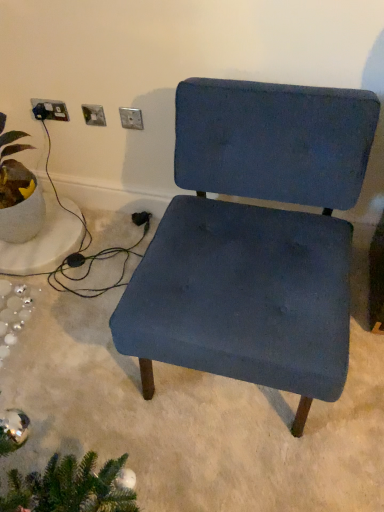
Where is `satin silver socket at upper center, which appears as the second electric outlet when viewed from the right`? Image resolution: width=384 pixels, height=512 pixels. satin silver socket at upper center, which appears as the second electric outlet when viewed from the right is located at coordinates (94, 115).

Measure the distance between point [133,113] and camera.

Point [133,113] and camera are 1.56 meters apart from each other.

Describe the element at coordinates (18, 191) in the screenshot. The width and height of the screenshot is (384, 512). I see `matte ceramic plant at left` at that location.

What is the approximate height of matte ceramic plant at left?

The height of matte ceramic plant at left is 49.73 centimeters.

Identify the location of satin silver socket at upper center, acting as the second electric outlet starting from the left. (94, 115).

At what (x,y) coordinates should I click in order to perform the action: click on electric outlet below the satin silver socket at upper center, which appears as the second electric outlet when viewed from the right (from the image's perspective). Please return your answer as a coordinate pair (x, y). The width and height of the screenshot is (384, 512). Looking at the image, I should click on (131, 118).

Considering the relative sizes of metallic silver outlet at upper center, the third electric outlet when ordered from left to right, and satin silver socket at upper center, which appears as the second electric outlet when viewed from the right, in the image provided, is metallic silver outlet at upper center, the third electric outlet when ordered from left to right, wider than satin silver socket at upper center, which appears as the second electric outlet when viewed from the right,?

Indeed, metallic silver outlet at upper center, the third electric outlet when ordered from left to right, has a greater width compared to satin silver socket at upper center, which appears as the second electric outlet when viewed from the right.

Considering the relative positions of metallic silver outlet at upper center, the 1th electric outlet from the right, and satin silver socket at upper center, acting as the second electric outlet starting from the left, in the image provided, is metallic silver outlet at upper center, the 1th electric outlet from the right, to the right of satin silver socket at upper center, acting as the second electric outlet starting from the left, from the viewer's perspective?

Yes.

Which is behind, point (142, 118) or point (88, 114)?

Positioned behind is point (88, 114).

Is satin silver socket at upper center, which appears as the second electric outlet when viewed from the right, next to metallic silver outlet at upper center, the 1th electric outlet from the right, and touching it?

No, satin silver socket at upper center, which appears as the second electric outlet when viewed from the right, is not with metallic silver outlet at upper center, the 1th electric outlet from the right.

Is the position of satin silver socket at upper center, acting as the second electric outlet starting from the left, more distant than that of metallic silver outlet at upper center, the 1th electric outlet from the right?

Yes, satin silver socket at upper center, acting as the second electric outlet starting from the left, is behind metallic silver outlet at upper center, the 1th electric outlet from the right.

Can you tell me how much satin silver socket at upper center, which appears as the second electric outlet when viewed from the right, and metallic silver outlet at upper center, the 1th electric outlet from the right, differ in facing direction?

satin silver socket at upper center, which appears as the second electric outlet when viewed from the right, and metallic silver outlet at upper center, the 1th electric outlet from the right, are facing 1.42 degrees away from each other.

Is point (104, 125) closer to camera compared to point (131, 113)?

No, (104, 125) is further to viewer.

Which is closer to the camera, (125, 320) or (101, 119)?

The point (125, 320) is in front.

Considering the relative sizes of velvet blue chair at center and satin silver socket at upper center, which appears as the second electric outlet when viewed from the right, in the image provided, is velvet blue chair at center thinner than satin silver socket at upper center, which appears as the second electric outlet when viewed from the right,?

No, velvet blue chair at center is not thinner than satin silver socket at upper center, which appears as the second electric outlet when viewed from the right.

Considering the relative positions of velvet blue chair at center and satin silver socket at upper center, acting as the second electric outlet starting from the left, in the image provided, is velvet blue chair at center to the right of satin silver socket at upper center, acting as the second electric outlet starting from the left, from the viewer's perspective?

Yes, velvet blue chair at center is to the right of satin silver socket at upper center, acting as the second electric outlet starting from the left.

Considering the sizes of matte ceramic plant at left and velvet blue chair at center in the image, is matte ceramic plant at left wider or thinner than velvet blue chair at center?

In the image, matte ceramic plant at left appears to be more narrow than velvet blue chair at center.

Can you confirm if matte ceramic plant at left is bigger than velvet blue chair at center?

Incorrect, matte ceramic plant at left is not larger than velvet blue chair at center.

Considering the positions of objects matte ceramic plant at left and velvet blue chair at center in the image provided, who is more to the left, matte ceramic plant at left or velvet blue chair at center?

matte ceramic plant at left is more to the left.

Is matte ceramic plant at left completely or partially outside of velvet blue chair at center?

Indeed, matte ceramic plant at left is completely outside velvet blue chair at center.

From a real-world perspective, which is physically below, matte ceramic plant at left or satin silver socket at upper left, the 1th electric outlet when ordered from left to right?

From a 3D spatial view, matte ceramic plant at left is below.

Relative to satin silver socket at upper left, the 1th electric outlet when ordered from left to right, is matte ceramic plant at left in front or behind?

matte ceramic plant at left is in front of satin silver socket at upper left, the 1th electric outlet when ordered from left to right.

Based on the photo, considering the sizes of objects matte ceramic plant at left and satin silver socket at upper left, positioned as the third electric outlet in right-to-left order, in the image provided, who is shorter, matte ceramic plant at left or satin silver socket at upper left, positioned as the third electric outlet in right-to-left order,?

With less height is satin silver socket at upper left, positioned as the third electric outlet in right-to-left order.

From the picture: Is there a large distance between satin silver socket at upper center, acting as the second electric outlet starting from the left, and velvet blue chair at center?

No, there isn't a large distance between satin silver socket at upper center, acting as the second electric outlet starting from the left, and velvet blue chair at center.

Image resolution: width=384 pixels, height=512 pixels. Identify the location of the 2nd electric outlet behind when counting from the velvet blue chair at center. (94, 115).

From a real-world perspective, between satin silver socket at upper center, acting as the second electric outlet starting from the left, and velvet blue chair at center, who is vertically lower?

velvet blue chair at center is physically lower.

Can you tell me how much satin silver socket at upper center, which appears as the second electric outlet when viewed from the right, and velvet blue chair at center differ in facing direction?

satin silver socket at upper center, which appears as the second electric outlet when viewed from the right, and velvet blue chair at center are facing 4.52 degrees away from each other.

Can you confirm if satin silver socket at upper center, which appears as the second electric outlet when viewed from the right, is bigger than satin silver socket at upper left, positioned as the third electric outlet in right-to-left order?

Actually, satin silver socket at upper center, which appears as the second electric outlet when viewed from the right, might be smaller than satin silver socket at upper left, positioned as the third electric outlet in right-to-left order.

Are satin silver socket at upper center, acting as the second electric outlet starting from the left, and satin silver socket at upper left, the 1th electric outlet when ordered from left to right, making contact?

No, satin silver socket at upper center, acting as the second electric outlet starting from the left, is not making contact with satin silver socket at upper left, the 1th electric outlet when ordered from left to right.

From the image's perspective, who appears lower, satin silver socket at upper center, acting as the second electric outlet starting from the left, or satin silver socket at upper left, the 1th electric outlet when ordered from left to right?

satin silver socket at upper center, acting as the second electric outlet starting from the left, appears lower in the image.

From a real-world perspective, starting from the satin silver socket at upper center, which appears as the second electric outlet when viewed from the right, which electric outlet is the 1st one vertically above it? Please provide its 2D coordinates.

[(131, 118)]

I want to click on the 1st electric outlet behind when counting from the metallic silver outlet at upper center, the third electric outlet when ordered from left to right, so click(94, 115).

When comparing their distances from velvet blue chair at center, does satin silver socket at upper left, positioned as the third electric outlet in right-to-left order, or metallic silver outlet at upper center, the third electric outlet when ordered from left to right, seem further?

satin silver socket at upper left, positioned as the third electric outlet in right-to-left order.

Which object lies nearer to the anchor point velvet blue chair at center, satin silver socket at upper center, which appears as the second electric outlet when viewed from the right, or matte ceramic plant at left?

Among the two, satin silver socket at upper center, which appears as the second electric outlet when viewed from the right, is located nearer to velvet blue chair at center.

Which object lies further to the anchor point matte ceramic plant at left, velvet blue chair at center or satin silver socket at upper center, which appears as the second electric outlet when viewed from the right?

Based on the image, velvet blue chair at center appears to be further to matte ceramic plant at left.

Based on their spatial positions, is metallic silver outlet at upper center, the 1th electric outlet from the right, or matte ceramic plant at left closer to satin silver socket at upper left, positioned as the third electric outlet in right-to-left order?

metallic silver outlet at upper center, the 1th electric outlet from the right, is closer to satin silver socket at upper left, positioned as the third electric outlet in right-to-left order.

Estimate the real-world distances between objects in this image. Which object is closer to metallic silver outlet at upper center, the third electric outlet when ordered from left to right, satin silver socket at upper left, positioned as the third electric outlet in right-to-left order, or matte ceramic plant at left?

The object closer to metallic silver outlet at upper center, the third electric outlet when ordered from left to right, is satin silver socket at upper left, positioned as the third electric outlet in right-to-left order.

Based on their spatial positions, is satin silver socket at upper center, which appears as the second electric outlet when viewed from the right, or velvet blue chair at center closer to satin silver socket at upper left, positioned as the third electric outlet in right-to-left order?

Based on the image, satin silver socket at upper center, which appears as the second electric outlet when viewed from the right, appears to be nearer to satin silver socket at upper left, positioned as the third electric outlet in right-to-left order.

Considering their positions, is matte ceramic plant at left positioned closer to satin silver socket at upper center, which appears as the second electric outlet when viewed from the right, than metallic silver outlet at upper center, the 1th electric outlet from the right?

Among the two, metallic silver outlet at upper center, the 1th electric outlet from the right, is located nearer to satin silver socket at upper center, which appears as the second electric outlet when viewed from the right.

When comparing their distances from matte ceramic plant at left, does satin silver socket at upper center, acting as the second electric outlet starting from the left, or satin silver socket at upper left, the 1th electric outlet when ordered from left to right, seem closer?

The object closer to matte ceramic plant at left is satin silver socket at upper left, the 1th electric outlet when ordered from left to right.

The image size is (384, 512). I want to click on houseplant located between velvet blue chair at center and metallic silver outlet at upper center, the 1th electric outlet from the right, in the depth direction, so click(x=18, y=191).

The height and width of the screenshot is (512, 384). I want to click on electric outlet between satin silver socket at upper left, the 1th electric outlet when ordered from left to right, and metallic silver outlet at upper center, the third electric outlet when ordered from left to right, so click(x=94, y=115).

Locate an element on the screen. electric outlet located between velvet blue chair at center and satin silver socket at upper center, which appears as the second electric outlet when viewed from the right, in the depth direction is located at coordinates (131, 118).

You are a GUI agent. You are given a task and a screenshot of the screen. Output one action in this format:
    pyautogui.click(x=<x>, y=<y>)
    Task: Click on the houseplant between velvet blue chair at center and satin silver socket at upper center, which appears as the second electric outlet when viewed from the right, from front to back
    The height and width of the screenshot is (512, 384).
    Given the screenshot: What is the action you would take?
    pyautogui.click(x=18, y=191)